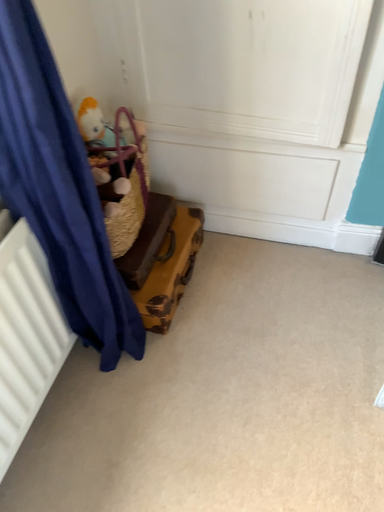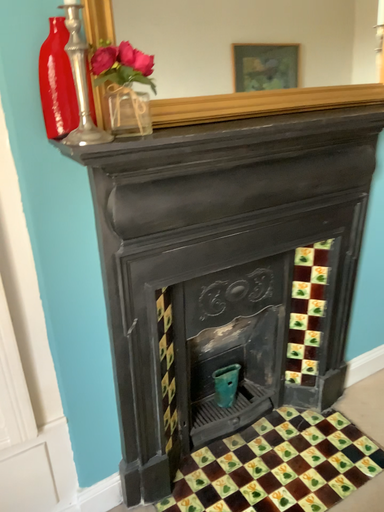
Question: How did the camera likely rotate when shooting the video?

Choices:
 (A) rotated upward
 (B) rotated downward

Answer: (A)